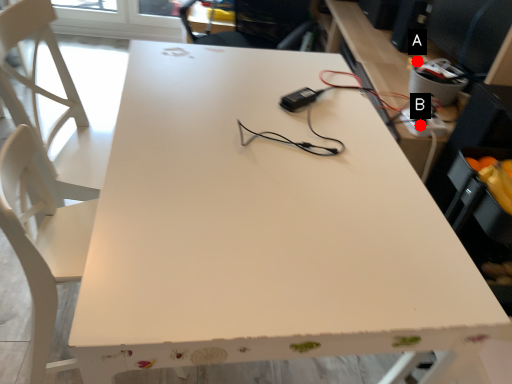
Question: Two points are circled on the image, labeled by A and B beside each circle. Which point is closer to the camera taking this photo?

Choices:
 (A) A is closer
 (B) B is closer

Answer: (B)